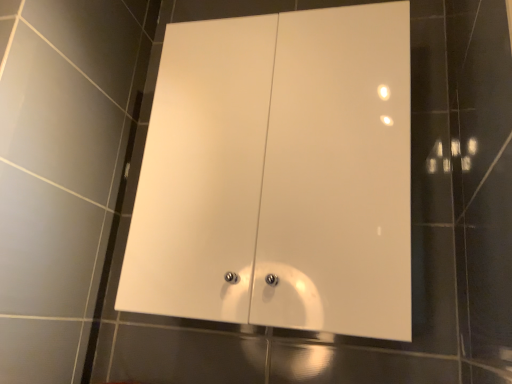
At what (x,y) coordinates should I click in order to perform the action: click on white glossy cabinet at center. Please return your answer as a coordinate pair (x, y). This screenshot has height=384, width=512. Looking at the image, I should click on coord(279,174).

Measure the distance between point (181, 179) and camera.

Point (181, 179) and camera are 31.26 inches apart from each other.

What do you see at coordinates (279, 174) in the screenshot? I see `white glossy cabinet at center` at bounding box center [279, 174].

In order to face white glossy cabinet at center, should I rotate leftwards or rightwards?

To align with it, rotate right about 3.216°.

The width and height of the screenshot is (512, 384). Identify the location of white glossy cabinet at center. (279, 174).